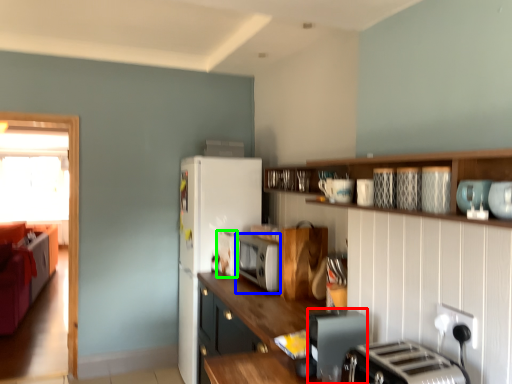
Question: Considering the real-world distances, which object is closest to appliance (highlighted by a red box)? appliance (highlighted by a blue box) or appliance (highlighted by a green box).

Choices:
 (A) appliance
 (B) appliance

Answer: (A)